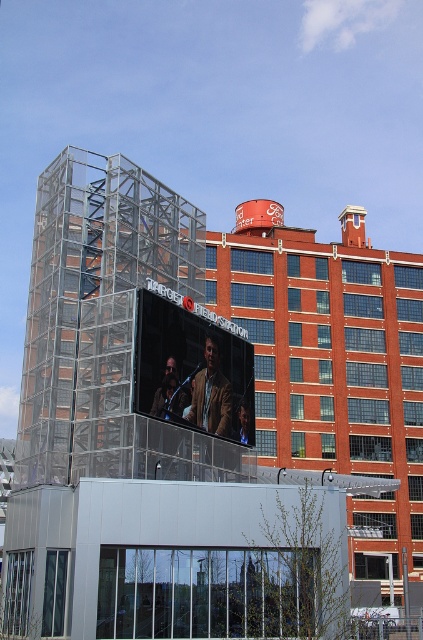
Does leather jacket at center have a smaller size compared to shiny black jacket at center?

No, leather jacket at center is not smaller than shiny black jacket at center.

Between leather jacket at center and shiny black jacket at center, which one is positioned lower?

shiny black jacket at center is below.

Is point (213, 358) positioned after point (156, 396)?

Yes, point (213, 358) is farther from viewer.

The height and width of the screenshot is (640, 423). I want to click on leather jacket at center, so click(x=211, y=394).

Is shiny black jacket at center thinner than matte brown jacket at center?

In fact, shiny black jacket at center might be wider than matte brown jacket at center.

Is point (172, 380) closer to viewer compared to point (241, 416)?

Yes.

You are a GUI agent. You are given a task and a screenshot of the screen. Output one action in this format:
    pyautogui.click(x=<x>, y=<y>)
    Task: Click on the shiny black jacket at center
    
    Given the screenshot: What is the action you would take?
    pyautogui.click(x=169, y=396)

Between point (198, 419) and point (249, 422), which one is positioned in front?

Point (198, 419) is in front.

Is leather jacket at center shorter than matte brown jacket at center?

No.

Between point (230, 429) and point (239, 432), which one is positioned in front?

Point (230, 429) is more forward.

This screenshot has width=423, height=640. Find the location of `leather jacket at center`. leather jacket at center is located at coordinates (211, 394).